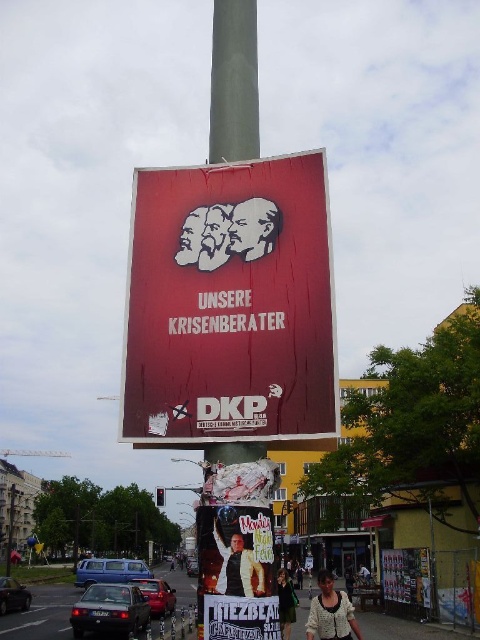
Question: Is metallic gold poster at center to the right of yellow leather jacket at center from the viewer's perspective?

Choices:
 (A) no
 (B) yes

Answer: (A)

Question: Can you confirm if green fabric dress at lower center is smaller than brushed metal pole at left?

Choices:
 (A) no
 (B) yes

Answer: (B)

Question: Considering the real-world distances, which object is closest to the green fabric dress at lower center?

Choices:
 (A) rusty metal poster at upper center
 (B) brushed metal pole at left
 (C) yellow leather jacket at center
 (D) metallic silver poster at center

Answer: (C)

Question: Which object appears closest to the camera in this image?

Choices:
 (A) metallic traffic light at center
 (B) brushed metal pole at left
 (C) rusty metal poster at upper center
 (D) metallic silver poster at center

Answer: (C)

Question: Which object is positioned closest to the rusty metal poster at upper center?

Choices:
 (A) brushed metal pole at left
 (B) metallic traffic light at center
 (C) yellow leather jacket at center
 (D) stenciled gray face at center

Answer: (D)

Question: Is stenciled gray face at center thinner than green fabric dress at lower center?

Choices:
 (A) no
 (B) yes

Answer: (B)